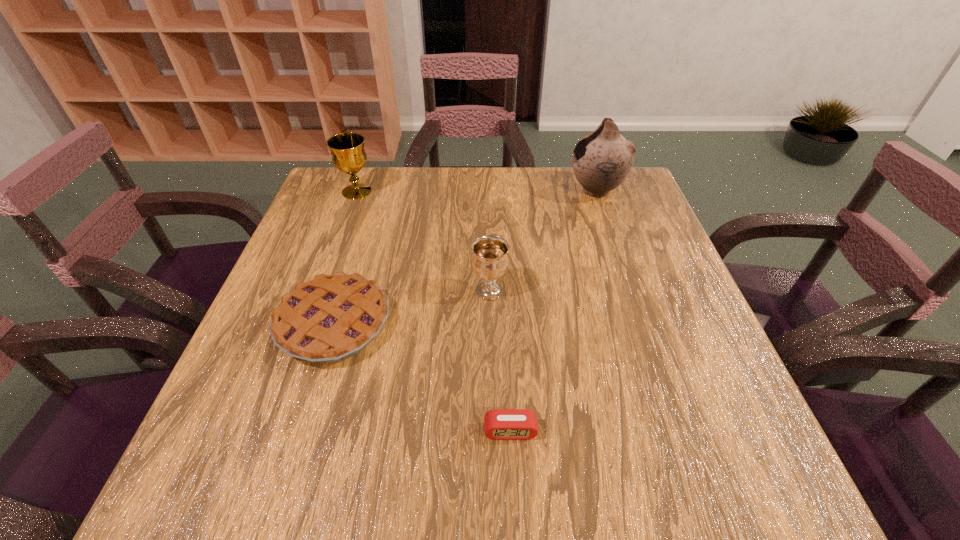
The image size is (960, 540). I want to click on object at the far left corner, so click(347, 150).

The height and width of the screenshot is (540, 960). What are the coordinates of `object that is at the far right corner` in the screenshot? It's located at (601, 161).

Find the location of a particular element. The height and width of the screenshot is (540, 960). blank space at the far edge of the desktop is located at coordinates click(387, 213).

Where is `vacant space at the left edge`? Image resolution: width=960 pixels, height=540 pixels. vacant space at the left edge is located at coordinates (350, 273).

Identify the location of vacant area at the right edge. The height and width of the screenshot is (540, 960). (600, 234).

Where is `free space at the near left corner of the desktop`? This screenshot has width=960, height=540. free space at the near left corner of the desktop is located at coordinates (286, 456).

Where is `free point between the fourth tallest object and the right chalice`? The image size is (960, 540). free point between the fourth tallest object and the right chalice is located at coordinates (412, 307).

Where is `free spot between the third tallest object and the farther chalice`? The width and height of the screenshot is (960, 540). free spot between the third tallest object and the farther chalice is located at coordinates (423, 241).

Where is `vacant point located between the rightmost object and the left chalice`? vacant point located between the rightmost object and the left chalice is located at coordinates (476, 191).

Locate an element on the screen. The image size is (960, 540). vacant area that lies between the alarm clock and the pottery is located at coordinates (553, 310).